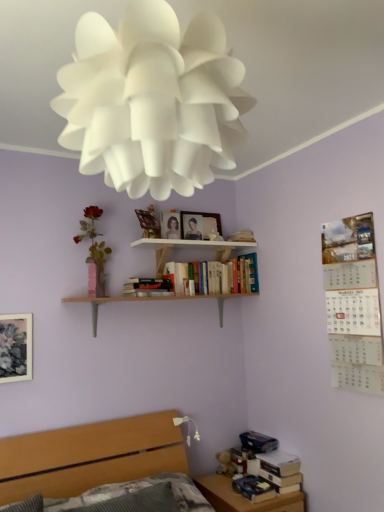
I want to click on matte wooden picture frame at upper center, placed as the first picture frame when sorted from back to front, so click(199, 225).

What is the approximate height of hardcover books at center, the 4th book in the bottom-to-top sequence?

hardcover books at center, the 4th book in the bottom-to-top sequence, is 10.79 inches tall.

Describe the element at coordinates (244, 498) in the screenshot. This screenshot has width=384, height=512. I see `wooden table at lower right` at that location.

Measure the distance between point (x=135, y=287) and camera.

A distance of 7.80 feet exists between point (x=135, y=287) and camera.

Describe the element at coordinates (93, 237) in the screenshot. The width and height of the screenshot is (384, 512). I see `matte pink vase at left, the 2th flower in the top-to-bottom sequence` at that location.

In order to face white matte bookshelf at upper center, which is counted as the 5th book, starting from the bottom, should I rotate leftwards or rightwards?

A 6.479 degree turn to the right will do.

Identify the location of matte wooden picture frame at upper center, which is the 3th picture frame from front to back. The image size is (384, 512). (199, 225).

From a real-world perspective, relative to matte wooden picture frame at upper center, which is counted as the third picture frame, starting from the bottom, is wooden bed at lower left vertically above or below?

Clearly, from a real-world perspective, wooden bed at lower left is below matte wooden picture frame at upper center, which is counted as the third picture frame, starting from the bottom.

Is wooden bed at lower left facing away from matte wooden picture frame at upper center, which is the 3th picture frame from front to back?

No, wooden bed at lower left is not facing away from matte wooden picture frame at upper center, which is the 3th picture frame from front to back.

Are wooden bed at lower left and matte wooden picture frame at upper center, which is the 3th picture frame from front to back, far apart?

Yes, wooden bed at lower left and matte wooden picture frame at upper center, which is the 3th picture frame from front to back, are quite far apart.

Is wooden table at lower right aimed at light wood/roughobject at center, the first shelf from the bottom?

No, wooden table at lower right is not turned towards light wood/roughobject at center, the first shelf from the bottom.

Can you confirm if wooden table at lower right is positioned to the right of light wood/roughobject at center, arranged as the second shelf when viewed from the top?

Yes.

Which of these two, wooden table at lower right or light wood/roughobject at center, arranged as the second shelf when viewed from the top, stands shorter?

Standing shorter between the two is light wood/roughobject at center, arranged as the second shelf when viewed from the top.

Based on the photo, is there a large distance between wooden table at lower right and light wood/roughobject at center, the first shelf from the bottom?

Yes, wooden table at lower right and light wood/roughobject at center, the first shelf from the bottom, are quite far apart.

Considering the points (91, 303) and (176, 233), which point is in front, point (91, 303) or point (176, 233)?

Point (91, 303)

Consider the image. Relative to matte wooden picture frame at upper center, arranged as the 2th picture frame when viewed from the back, is light wood/roughobject at center, arranged as the second shelf when viewed from the top, in front or behind?

light wood/roughobject at center, arranged as the second shelf when viewed from the top, is in front of matte wooden picture frame at upper center, arranged as the 2th picture frame when viewed from the back.

Based on the photo, is light wood/roughobject at center, arranged as the second shelf when viewed from the top, touching matte wooden picture frame at upper center, which is the 2th picture frame from right to left?

No, light wood/roughobject at center, arranged as the second shelf when viewed from the top, is not making contact with matte wooden picture frame at upper center, which is the 2th picture frame from right to left.

Considering the sizes of objects light wood/roughobject at center, arranged as the second shelf when viewed from the top, and matte wooden picture frame at upper center, acting as the 2th picture frame starting from the left, in the image provided, who is wider, light wood/roughobject at center, arranged as the second shelf when viewed from the top, or matte wooden picture frame at upper center, acting as the 2th picture frame starting from the left,?

Wider between the two is light wood/roughobject at center, arranged as the second shelf when viewed from the top.

This screenshot has height=512, width=384. I want to click on book that is the 4th one when counting downward from the white matte bookshelf at upper center, which is the 1th book from top to bottom (from the image's perspective), so 253,488.

Which is more to the left, hardcover book at lower right, the 1th book positioned from the bottom, or white matte bookshelf at upper center, which is the 1th book from top to bottom?

white matte bookshelf at upper center, which is the 1th book from top to bottom, is more to the left.

How much distance is there between hardcover book at lower right, the 1th book positioned from the bottom, and white matte bookshelf at upper center, which is the 1th book from top to bottom?

The distance of hardcover book at lower right, the 1th book positioned from the bottom, from white matte bookshelf at upper center, which is the 1th book from top to bottom, is 4.69 feet.

Is white paper flower at upper center, the 2th flower positioned from the back, spatially inside matte wooden picture frame at upper center, arranged as the 2th picture frame when viewed from the back, or outside of it?

white paper flower at upper center, the 2th flower positioned from the back, is outside matte wooden picture frame at upper center, arranged as the 2th picture frame when viewed from the back.

Find the location of `the 2nd picture frame below the white paper flower at upper center, which ranks as the 2th flower in left-to-right order (from the image's perspective)`. the 2nd picture frame below the white paper flower at upper center, which ranks as the 2th flower in left-to-right order (from the image's perspective) is located at coordinates (170, 225).

Considering the relative sizes of white paper flower at upper center, the 2th flower positioned from the back, and matte wooden picture frame at upper center, arranged as the second picture frame when viewed from the top, in the image provided, is white paper flower at upper center, the 2th flower positioned from the back, thinner than matte wooden picture frame at upper center, arranged as the second picture frame when viewed from the top,?

No.

Considering the relative sizes of fluffy fabric teddy bear at lower right and matte wooden picture frame at upper center, which is the 3th picture frame from front to back, in the image provided, is fluffy fabric teddy bear at lower right smaller than matte wooden picture frame at upper center, which is the 3th picture frame from front to back,?

Correct, fluffy fabric teddy bear at lower right occupies less space than matte wooden picture frame at upper center, which is the 3th picture frame from front to back.

How many degrees apart are the facing directions of fluffy fabric teddy bear at lower right and matte wooden picture frame at upper center, which is counted as the third picture frame, starting from the bottom?

They differ by 0.711 degrees in their facing directions.

Is matte wooden picture frame at upper center, positioned as the third picture frame in left-to-right order, inside fluffy fabric teddy bear at lower right?

No, matte wooden picture frame at upper center, positioned as the third picture frame in left-to-right order, is located outside of fluffy fabric teddy bear at lower right.

This screenshot has height=512, width=384. Find the location of `toy in front of the matte wooden picture frame at upper center, the first picture frame from the top`. toy in front of the matte wooden picture frame at upper center, the first picture frame from the top is located at coordinates (225, 464).

Considering the relative sizes of matte floral print picture frame at left, the 1th picture frame when ordered from bottom to top, and white paper flower at upper center, which appears as the 2th flower when ordered from the bottom, in the image provided, is matte floral print picture frame at left, the 1th picture frame when ordered from bottom to top, bigger than white paper flower at upper center, which appears as the 2th flower when ordered from the bottom,?

Actually, matte floral print picture frame at left, the 1th picture frame when ordered from bottom to top, might be smaller than white paper flower at upper center, which appears as the 2th flower when ordered from the bottom.

Where is `the 2nd flower to the right of the matte floral print picture frame at left, acting as the first picture frame starting from the front, starting your count from the anchor`? Image resolution: width=384 pixels, height=512 pixels. the 2nd flower to the right of the matte floral print picture frame at left, acting as the first picture frame starting from the front, starting your count from the anchor is located at coordinates (152, 100).

In the image, is matte floral print picture frame at left, which is counted as the 3th picture frame, starting from the right, positioned in front of or behind white paper flower at upper center, the 2th flower positioned from the back?

Visually, matte floral print picture frame at left, which is counted as the 3th picture frame, starting from the right, is located behind white paper flower at upper center, the 2th flower positioned from the back.

Identify the location of bed that is under the matte wooden picture frame at upper center, placed as the first picture frame when sorted from back to front (from a real-world perspective). (90, 456).

Identify the location of table that is on the right side of light wood/roughobject at center, arranged as the second shelf when viewed from the top. This screenshot has height=512, width=384. (244, 498).

When comparing their distances from hardcover book at lower right, the fifth book viewed from the top, does white matte bookshelf at upper center, which is counted as the 5th book, starting from the bottom, or wooden table at lower right seem further?

Among the two, white matte bookshelf at upper center, which is counted as the 5th book, starting from the bottom, is located further to hardcover book at lower right, the fifth book viewed from the top.

Based on the photo, which object lies nearer to the anchor point light wood/roughobject at center, arranged as the second shelf when viewed from the top, matte wooden picture frame at upper center, positioned as the third picture frame in left-to-right order, or white matte bookshelf at upper center, which is the 1th book from top to bottom?

The object closer to light wood/roughobject at center, arranged as the second shelf when viewed from the top, is matte wooden picture frame at upper center, positioned as the third picture frame in left-to-right order.

Based on their spatial positions, is hardcover books at center, marked as the second book in a top-to-bottom arrangement, or wooden bookshelf at upper center, which appears as the second shelf when ordered from the bottom, further from wooden table at lower right?

wooden bookshelf at upper center, which appears as the second shelf when ordered from the bottom.

When comparing their distances from wooden bed at lower left, does matte wooden picture frame at upper center, placed as the first picture frame when sorted from back to front, or white paper flower at upper center, the 2th flower positioned from the back, seem closer?

Among the two, matte wooden picture frame at upper center, placed as the first picture frame when sorted from back to front, is located nearer to wooden bed at lower left.

In the scene shown: Based on their spatial positions, is hardcover book at lower right, arranged as the fourth book when viewed from the top, or matte wooden picture frame at upper center, placed as the 2th picture frame when sorted from front to back, further from hardcover books at center, the 4th book in the bottom-to-top sequence?

Among the two, hardcover book at lower right, arranged as the fourth book when viewed from the top, is located further to hardcover books at center, the 4th book in the bottom-to-top sequence.

Looking at the image, which one is located closer to matte floral print picture frame at left, the third picture frame from the top, white paper flower at upper center, which ranks as the first flower in top-to-bottom order, or white paper calendar at upper right?

white paper flower at upper center, which ranks as the first flower in top-to-bottom order.

Looking at the image, which one is located closer to wooden table at lower right, hardcover book at lower right, arranged as the fourth book when viewed from the top, or hardcover book at lower right, the 1th book positioned from the bottom?

Based on the image, hardcover book at lower right, the 1th book positioned from the bottom, appears to be nearer to wooden table at lower right.

When comparing their distances from matte floral print picture frame at left, the 1th picture frame when ordered from bottom to top, does matte black tool at center, the 3th book in the bottom-to-top sequence, or hardcover books at center, the 4th book in the bottom-to-top sequence, seem further?

hardcover books at center, the 4th book in the bottom-to-top sequence.

This screenshot has width=384, height=512. What are the coordinates of `bulletin board between hardcover books at center, the 4th book in the bottom-to-top sequence, and hardcover book at lower right, the fifth book viewed from the top, from top to bottom` in the screenshot? It's located at (353, 304).

The height and width of the screenshot is (512, 384). I want to click on book situated between matte floral print picture frame at left, acting as the first picture frame starting from the front, and matte wooden picture frame at upper center, acting as the 2th picture frame starting from the left, from left to right, so (x=147, y=287).

Find the location of `picture frame between matte pink vase at left, the first flower in the back-to-front sequence, and wooden bookshelf at upper center, which appears as the second shelf when ordered from the bottom`. picture frame between matte pink vase at left, the first flower in the back-to-front sequence, and wooden bookshelf at upper center, which appears as the second shelf when ordered from the bottom is located at coordinates (170, 225).

Image resolution: width=384 pixels, height=512 pixels. What are the coordinates of `shelf located between matte wooden picture frame at upper center, arranged as the 2th picture frame when viewed from the back, and white matte bookshelf at upper center, which is counted as the 5th book, starting from the bottom, in the left-right direction` in the screenshot? It's located at (193, 249).